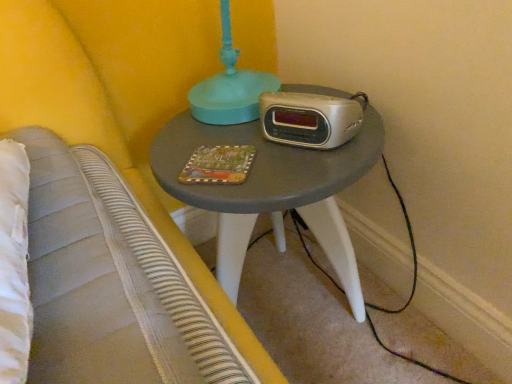
Question: Is matte painted wood book at center to the left of silver metallic clock radio at center from the viewer's perspective?

Choices:
 (A) no
 (B) yes

Answer: (B)

Question: Is matte painted wood book at center bigger than silver metallic clock radio at center?

Choices:
 (A) no
 (B) yes

Answer: (A)

Question: Is matte painted wood book at center positioned with its back to silver metallic clock radio at center?

Choices:
 (A) no
 (B) yes

Answer: (A)

Question: Does matte painted wood book at center turn towards silver metallic clock radio at center?

Choices:
 (A) no
 (B) yes

Answer: (A)

Question: Is matte painted wood book at center taller than silver metallic clock radio at center?

Choices:
 (A) yes
 (B) no

Answer: (B)

Question: Can you confirm if matte painted wood book at center is wider than silver metallic clock radio at center?

Choices:
 (A) no
 (B) yes

Answer: (B)

Question: Can you confirm if matte gray table at center is wider than silver metallic clock radio at center?

Choices:
 (A) no
 (B) yes

Answer: (B)

Question: Does matte gray table at center have a lesser height compared to silver metallic clock radio at center?

Choices:
 (A) yes
 (B) no

Answer: (B)

Question: Could you tell me if matte gray table at center is facing silver metallic clock radio at center?

Choices:
 (A) no
 (B) yes

Answer: (A)

Question: Does matte gray table at center appear on the right side of silver metallic clock radio at center?

Choices:
 (A) no
 (B) yes

Answer: (A)

Question: Considering the relative sizes of matte gray table at center and silver metallic clock radio at center in the image provided, is matte gray table at center smaller than silver metallic clock radio at center?

Choices:
 (A) no
 (B) yes

Answer: (A)

Question: Is there a large distance between matte gray table at center and silver metallic clock radio at center?

Choices:
 (A) yes
 (B) no

Answer: (B)

Question: Considering the relative sizes of silver metallic clock radio at center and matte painted wood book at center in the image provided, is silver metallic clock radio at center taller than matte painted wood book at center?

Choices:
 (A) yes
 (B) no

Answer: (A)